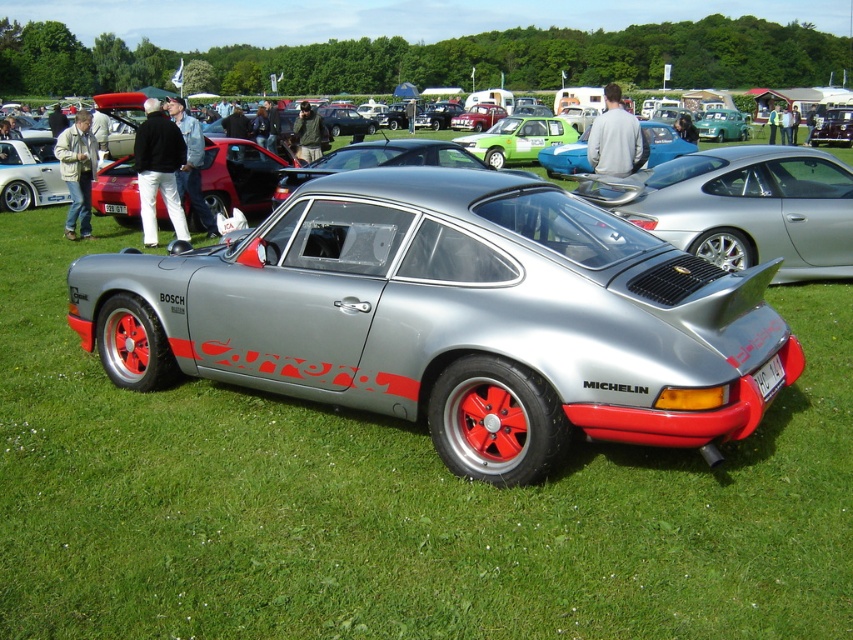
Who is positioned more to the left, green matte hatchback at center or metallic silver car at center?

green matte hatchback at center is more to the left.

Is green matte hatchback at center further to the viewer compared to metallic silver car at center?

No, it is in front of metallic silver car at center.

You are a GUI agent. You are given a task and a screenshot of the screen. Output one action in this format:
    pyautogui.click(x=<x>, y=<y>)
    Task: Click on the green matte hatchback at center
    Image resolution: width=853 pixels, height=640 pixels.
    Given the screenshot: What is the action you would take?
    pyautogui.click(x=517, y=138)

This screenshot has height=640, width=853. Describe the element at coordinates (451, 317) in the screenshot. I see `satin metallic car at center` at that location.

The width and height of the screenshot is (853, 640). I want to click on satin metallic car at center, so [451, 317].

Does point (479, 236) come behind point (491, 160)?

That is False.

Find the location of a particular element. satin metallic car at center is located at coordinates (451, 317).